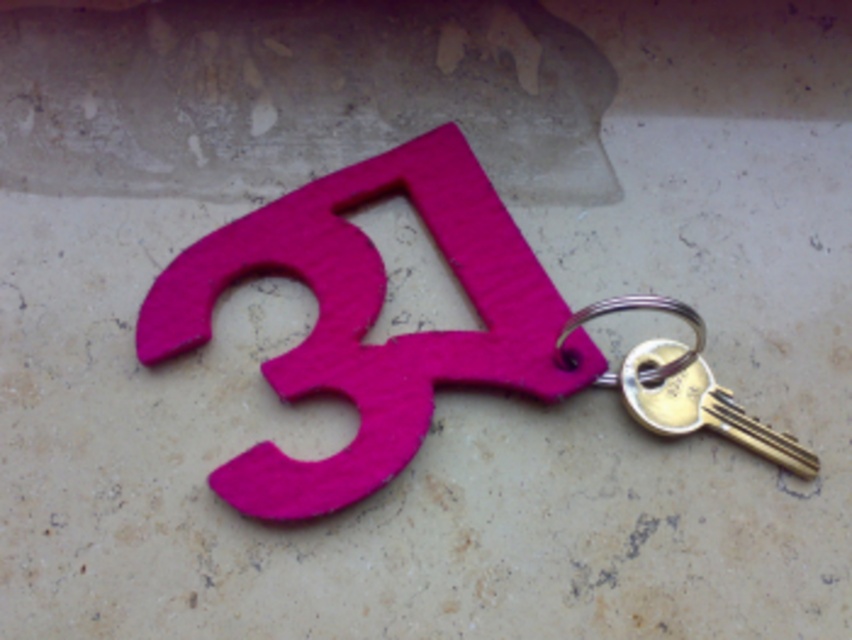
Is point (335, 385) in front of point (714, 392)?

That is True.

Who is more forward, (x=167, y=353) or (x=689, y=365)?

Point (x=167, y=353) is in front.

Which is behind, point (519, 280) or point (657, 410)?

The point (519, 280) is behind.

I want to click on matte pink keychain at center, so click(371, 317).